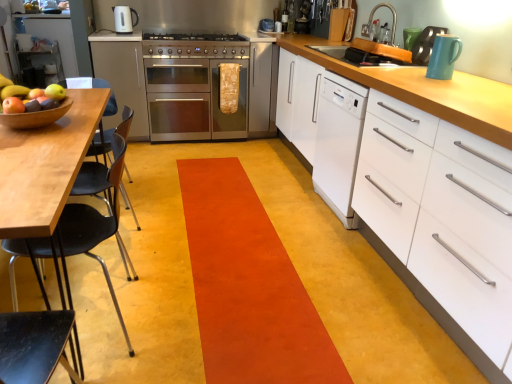
Question: Is the position of wooden bowl at left more distant than that of satin silver oven at center, the 2th cabinetry in the front-to-back sequence?

Choices:
 (A) no
 (B) yes

Answer: (A)

Question: From the image's perspective, is wooden bowl at left located beneath satin silver oven at center, the 1th cabinetry viewed from the top?

Choices:
 (A) no
 (B) yes

Answer: (B)

Question: Is wooden bowl at left not within satin silver oven at center, the 1th cabinetry viewed from the back?

Choices:
 (A) no
 (B) yes

Answer: (B)

Question: Is wooden bowl at left positioned in front of satin silver oven at center, the second cabinetry when ordered from right to left?

Choices:
 (A) yes
 (B) no

Answer: (A)

Question: Is wooden bowl at left wider than satin silver oven at center, the 2th cabinetry in the front-to-back sequence?

Choices:
 (A) yes
 (B) no

Answer: (B)

Question: In terms of height, does metallic faucet at upper right, which appears as the second appliance when ordered from the bottom, look taller or shorter compared to orange carpet at center?

Choices:
 (A) tall
 (B) short

Answer: (A)

Question: From the image's perspective, relative to orange carpet at center, is metallic faucet at upper right, which appears as the second appliance when ordered from the bottom, above or below?

Choices:
 (A) below
 (B) above

Answer: (B)

Question: Looking at their shapes, would you say metallic faucet at upper right, arranged as the 1th appliance when viewed from the left, is wider or thinner than orange carpet at center?

Choices:
 (A) wide
 (B) thin

Answer: (B)

Question: Does point (374, 6) appear closer or farther from the camera than point (204, 288)?

Choices:
 (A) closer
 (B) farther

Answer: (B)

Question: From a real-world perspective, is black plastic chair at left above or below white glossy dishwasher at center right?

Choices:
 (A) above
 (B) below

Answer: (B)

Question: Is black plastic chair at left in front of or behind white glossy dishwasher at center right in the image?

Choices:
 (A) behind
 (B) front

Answer: (B)

Question: Considering the positions of point (117, 192) and point (325, 175), is point (117, 192) closer or farther from the camera than point (325, 175)?

Choices:
 (A) farther
 (B) closer

Answer: (B)

Question: Is black plastic chair at left bigger or smaller than white glossy dishwasher at center right?

Choices:
 (A) big
 (B) small

Answer: (B)

Question: From the image's perspective, is stainless steel oven at center located above or below black plastic chair at left?

Choices:
 (A) below
 (B) above

Answer: (B)

Question: From a real-world perspective, is stainless steel oven at center physically located above or below black plastic chair at left?

Choices:
 (A) above
 (B) below

Answer: (B)